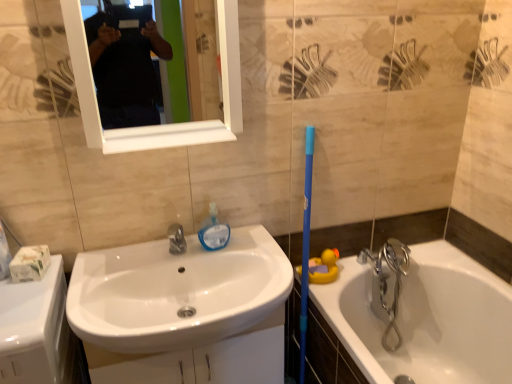
The width and height of the screenshot is (512, 384). I want to click on vacant space that is to the left of translucent plastic soap dispenser at center, so click(154, 257).